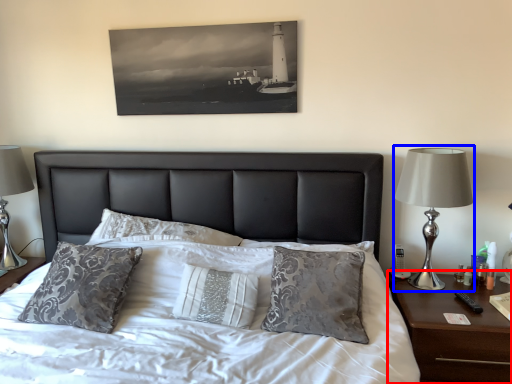
Question: Among these objects, which one is farthest to the camera, nightstand (highlighted by a red box) or bedside lamp (highlighted by a blue box)?

Choices:
 (A) nightstand
 (B) bedside lamp

Answer: (B)